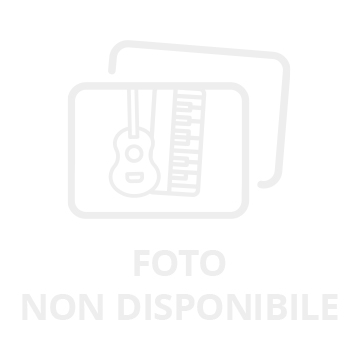
This screenshot has width=360, height=360. What are the coordinates of `upper keys on clipart keyboard` in the screenshot? It's located at (175, 159), (178, 177), (182, 105), (182, 143), (181, 131).